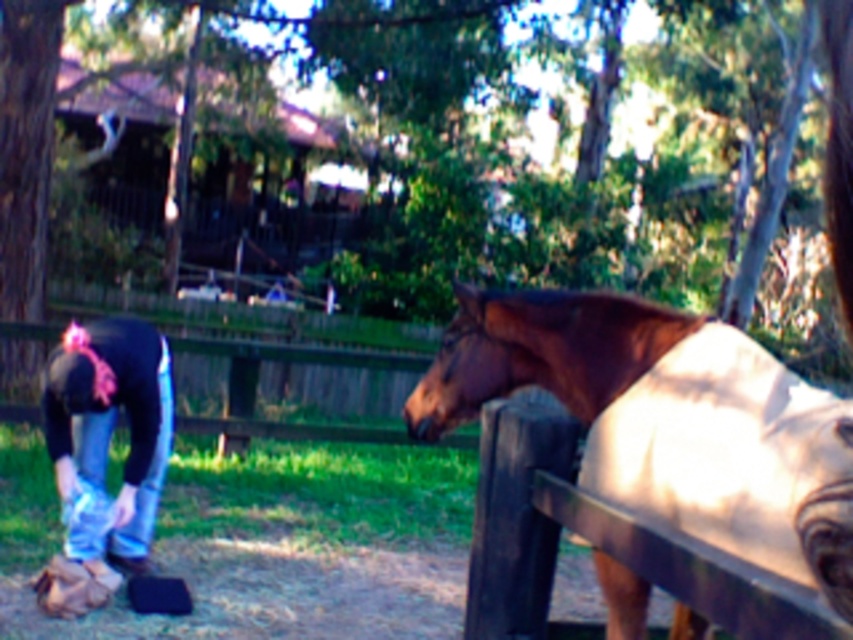
Question: Can you confirm if brown glossy horse at right is positioned to the left of blue jeans at lower left?

Choices:
 (A) yes
 (B) no

Answer: (B)

Question: Among these objects, which one is farthest from the camera?

Choices:
 (A) blue jeans at lower left
 (B) brown glossy horse at right

Answer: (A)

Question: Is brown glossy horse at right closer to the viewer compared to blue jeans at lower left?

Choices:
 (A) no
 (B) yes

Answer: (B)

Question: Which object is farther from the camera taking this photo?

Choices:
 (A) blue jeans at lower left
 (B) brown glossy horse at right

Answer: (A)

Question: Where is brown glossy horse at right located in relation to blue jeans at lower left in the image?

Choices:
 (A) above
 (B) below

Answer: (A)